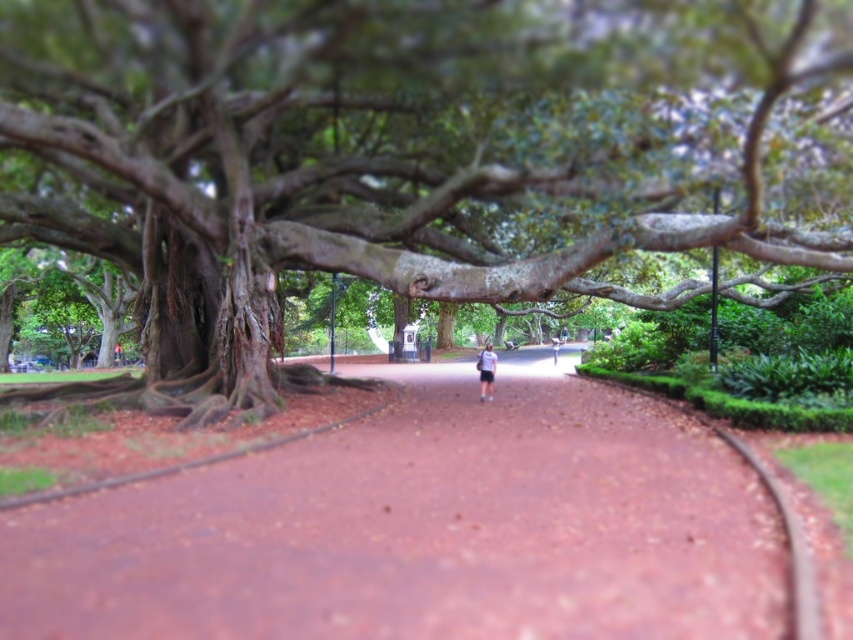
Question: Is green rough bark tree at upper center above white fabric shirt at center?

Choices:
 (A) yes
 (B) no

Answer: (A)

Question: Which of the following is the closest to the observer?

Choices:
 (A) (552, 340)
 (B) (492, 349)
 (C) (157, 154)

Answer: (C)

Question: Is green rough bark tree at upper center further to the viewer compared to white fabric shirt at center?

Choices:
 (A) yes
 (B) no

Answer: (B)

Question: Estimate the real-world distances between objects in this image. Which object is farther from the reddish-brown concrete pavement at center?

Choices:
 (A) white fabric shirt at center
 (B) green rough bark tree at upper center
 (C) white cotton shirt at center

Answer: (C)

Question: Considering the real-world distances, which object is farthest from the white cotton shirt at center?

Choices:
 (A) white fabric shirt at center
 (B) reddish-brown concrete pavement at center

Answer: (B)

Question: Is white fabric shirt at center to the right of white cotton shirt at center from the viewer's perspective?

Choices:
 (A) no
 (B) yes

Answer: (A)